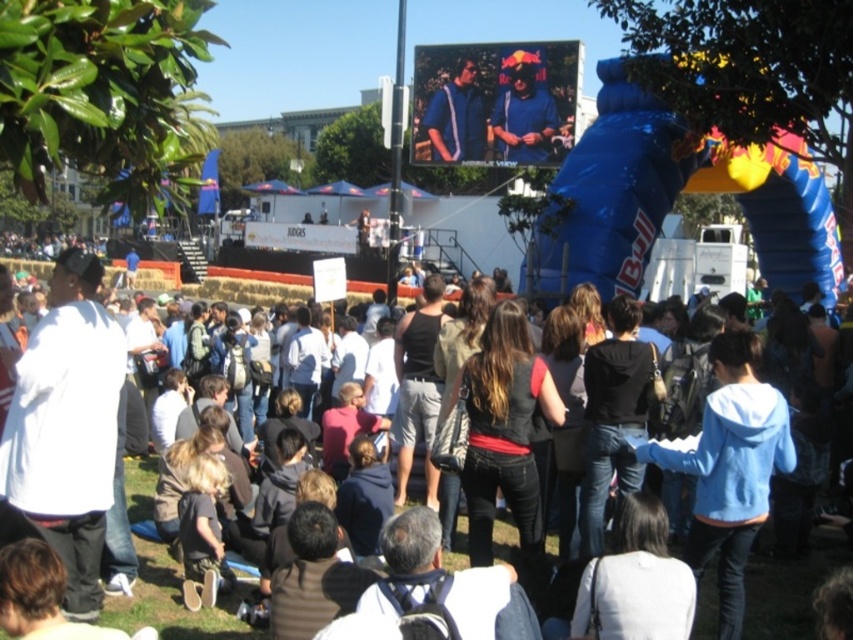
Find the location of `matte blue jacket at center`. matte blue jacket at center is located at coordinates (524, 116).

Does matte blue jacket at center have a lesser height compared to blue fabric jacket at upper center?

Indeed, matte blue jacket at center has a lesser height compared to blue fabric jacket at upper center.

Locate an element on the screen. matte blue jacket at center is located at coordinates (524, 116).

What do you see at coordinates (788, 588) in the screenshot?
I see `dark blue jeans at center` at bounding box center [788, 588].

Where is `dark blue jeans at center`? Image resolution: width=853 pixels, height=640 pixels. dark blue jeans at center is located at coordinates (788, 588).

Who is positioned more to the right, dark blue jeans at center or blue fabric jacket at upper center?

Positioned to the right is blue fabric jacket at upper center.

Describe the element at coordinates (788, 588) in the screenshot. The height and width of the screenshot is (640, 853). I see `dark blue jeans at center` at that location.

Locate an element on the screen. Image resolution: width=853 pixels, height=640 pixels. dark blue jeans at center is located at coordinates (788, 588).

You are a GUI agent. You are given a task and a screenshot of the screen. Output one action in this format:
    pyautogui.click(x=<x>, y=<y>)
    Task: Click on the dark blue jeans at center
    Image resolution: width=853 pixels, height=640 pixels.
    Given the screenshot: What is the action you would take?
    pyautogui.click(x=788, y=588)